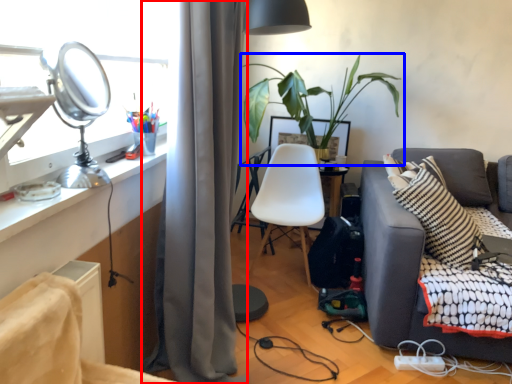
Question: Which of the following is the farthest to the observer, curtain (highlighted by a red box) or houseplant (highlighted by a blue box)?

Choices:
 (A) curtain
 (B) houseplant

Answer: (B)